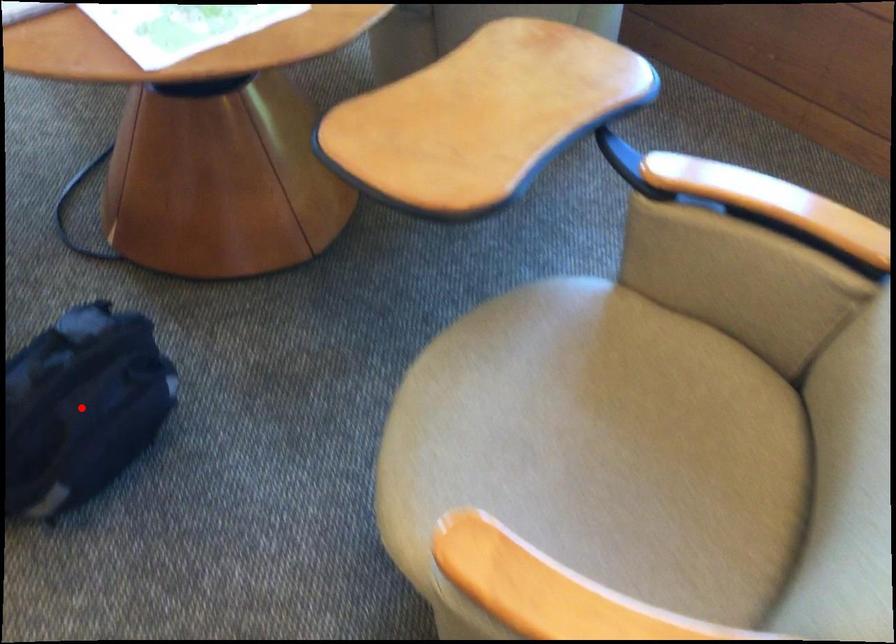
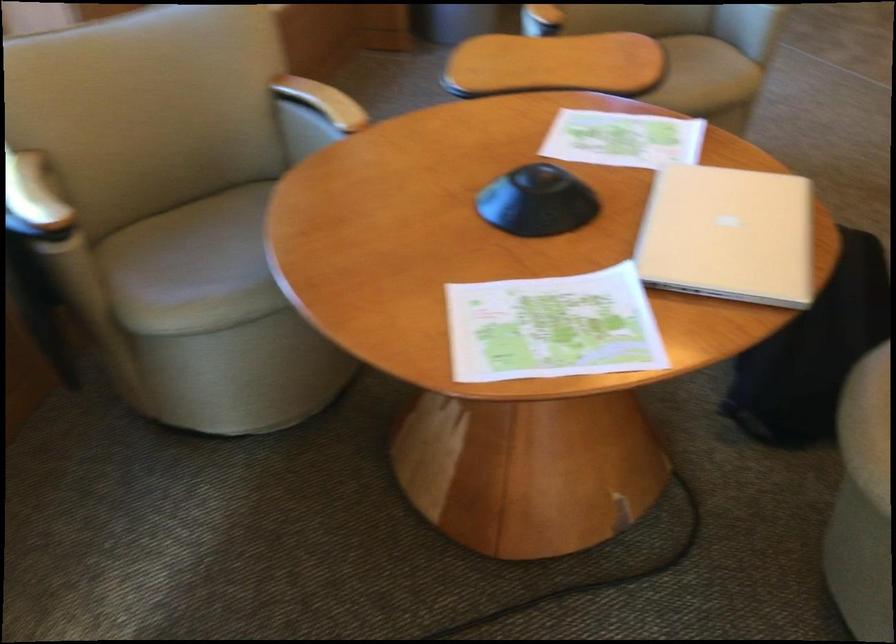
Question: I am providing you with two images of the same scene from different viewpoints. A red point is marked on the first image. Can you still see the location of the red point in image 2?

Choices:
 (A) Yes
 (B) No

Answer: (B)